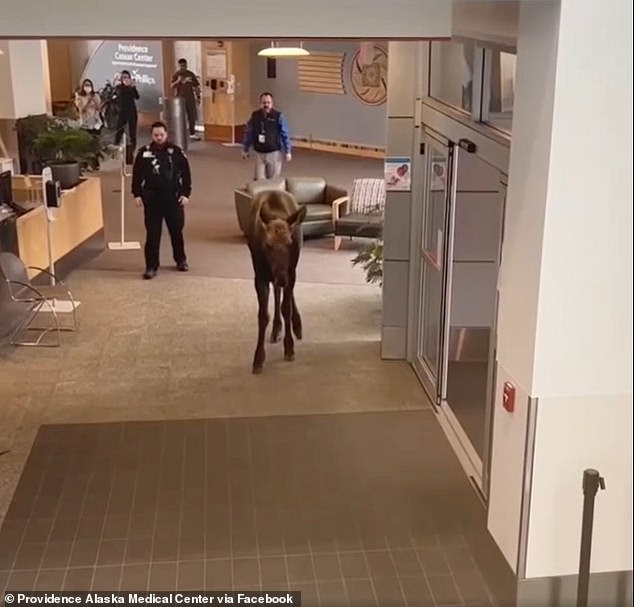
Find the location of `fire alarm pull switch`. fire alarm pull switch is located at coordinates (503, 399).